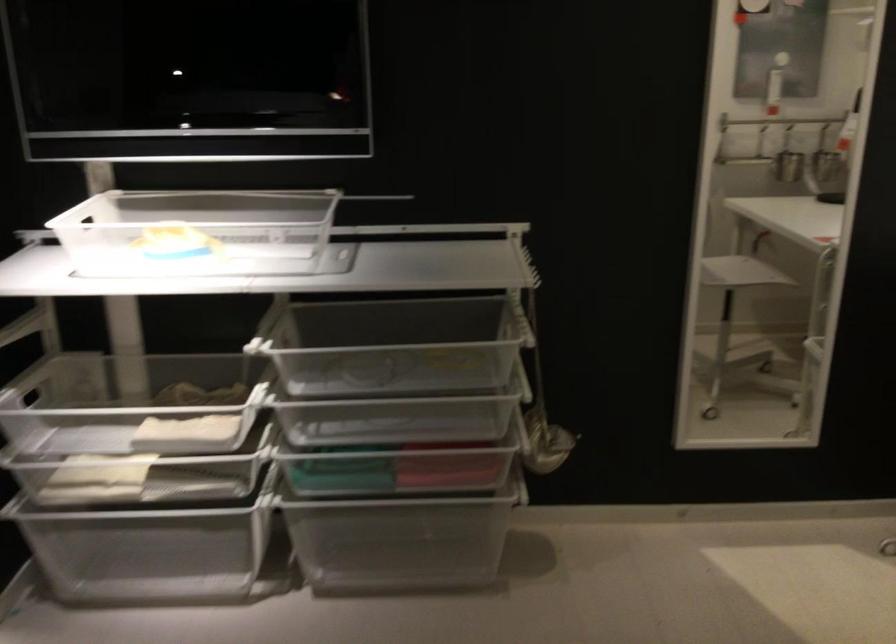
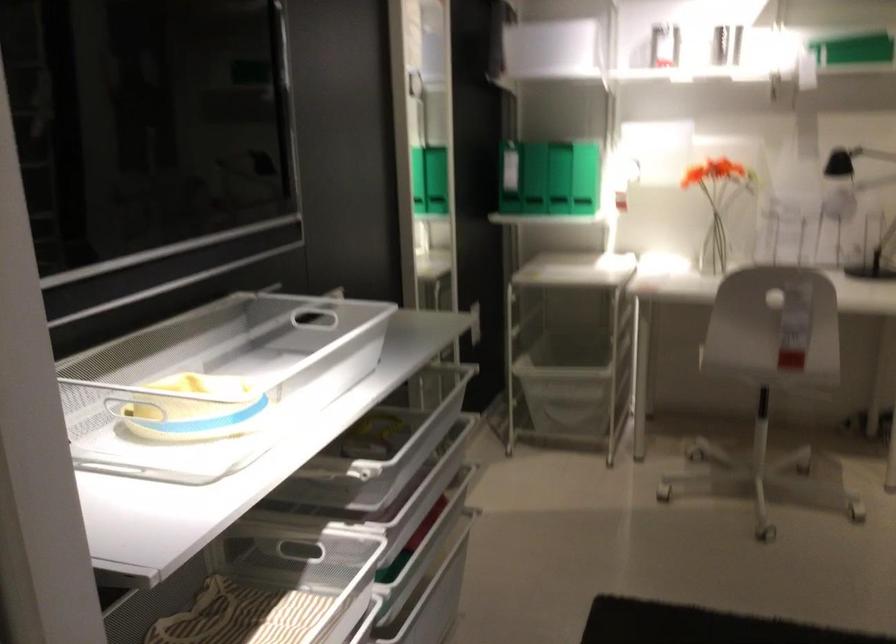
Find the pixel in the second image that matches point (168, 265) in the first image.

(216, 383)